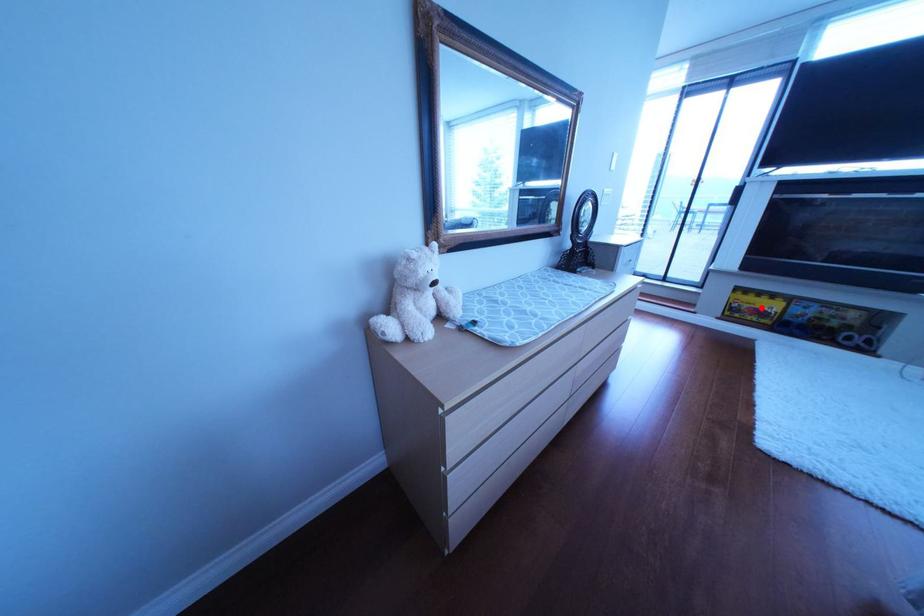
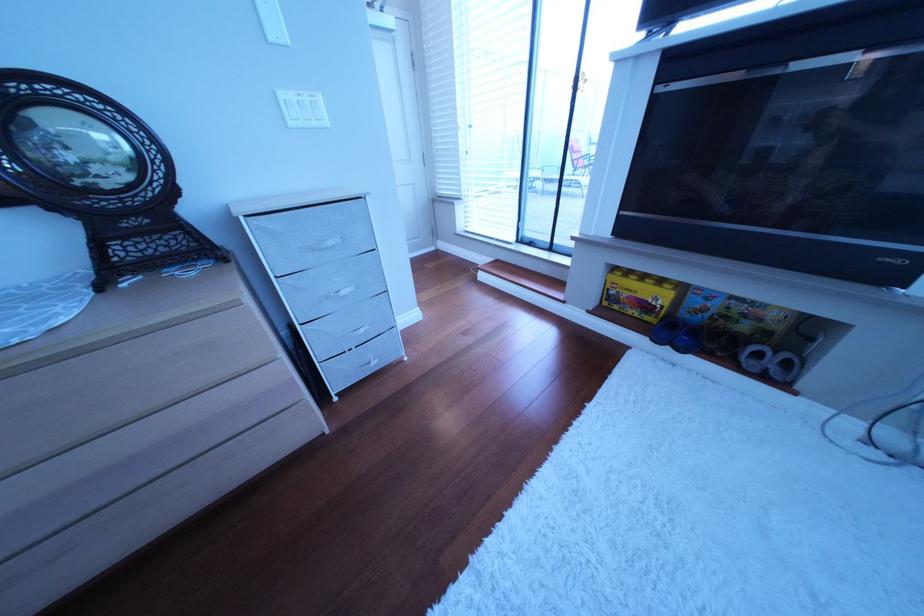
The point at the highlighted location is marked in the first image. Where is the corresponding point in the second image?

(640, 296)